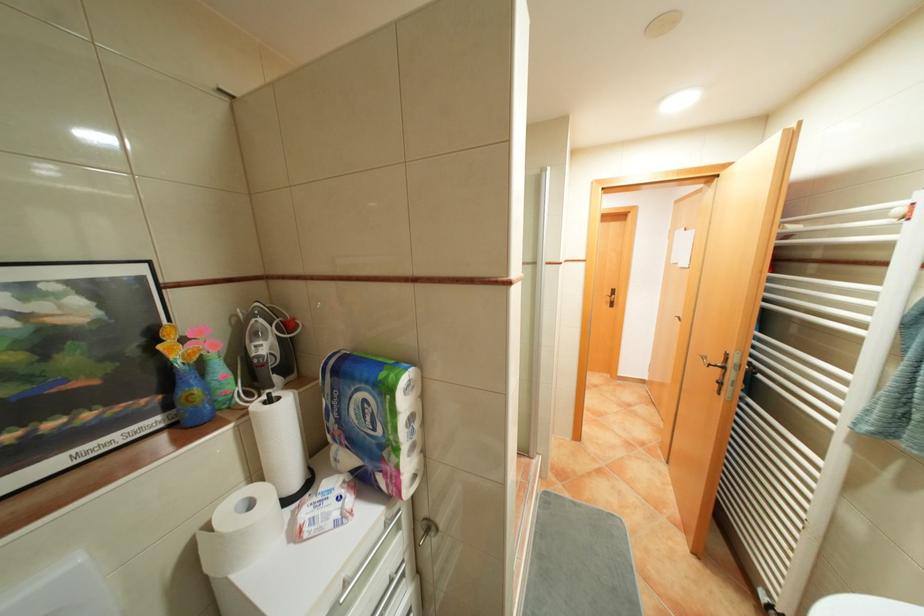
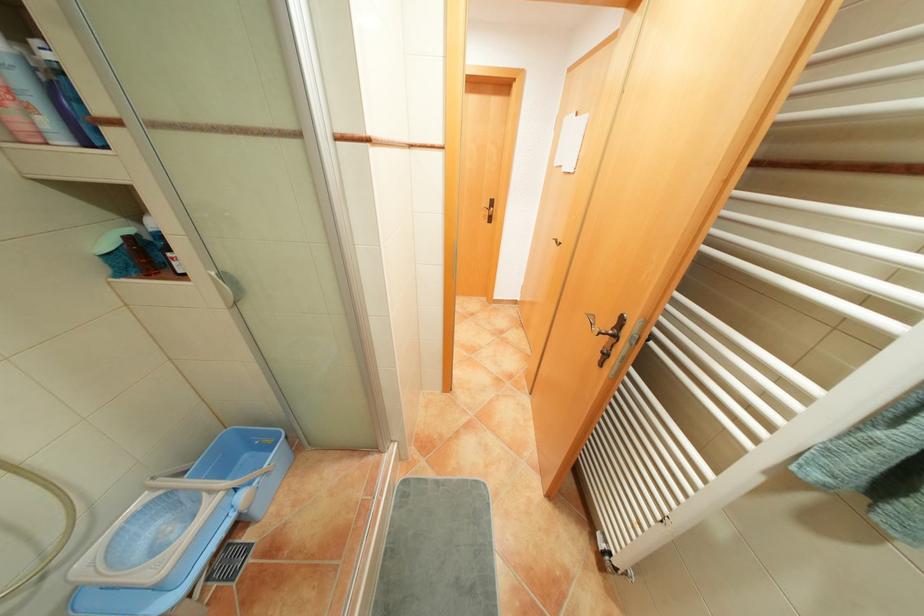
Locate, in the second image, the point that corresponds to [720,363] in the first image.

(609, 333)